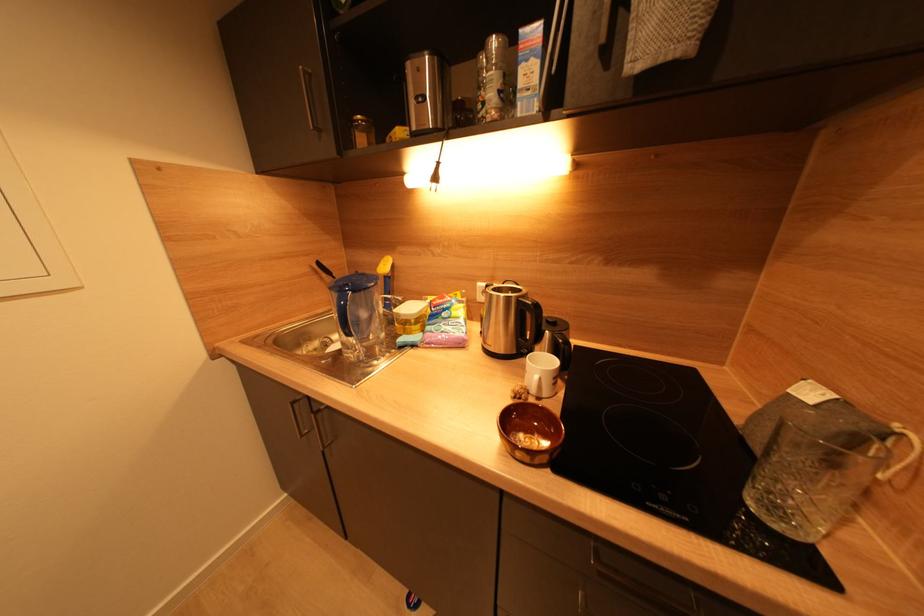
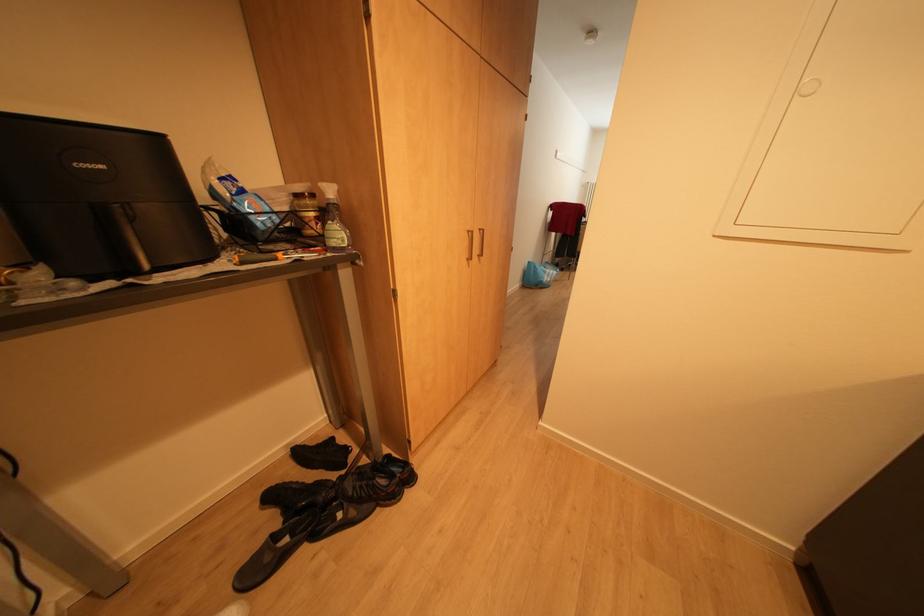
First-person continuous shooting, in which direction is the camera rotating?

The camera rotated toward left-down.